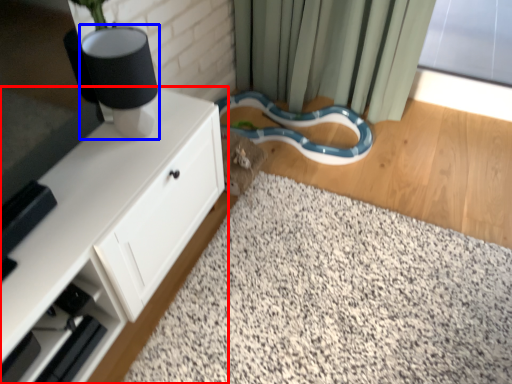
Question: Which of the following is the closest to the observer, cabinetry (highlighted by a red box) or table lamp (highlighted by a blue box)?

Choices:
 (A) cabinetry
 (B) table lamp

Answer: (A)